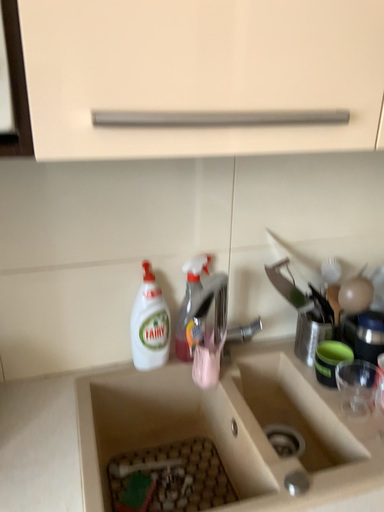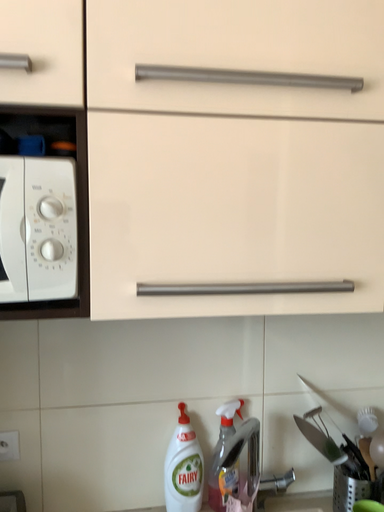
Question: Which way did the camera rotate in the video?

Choices:
 (A) rotated downward
 (B) rotated upward

Answer: (B)